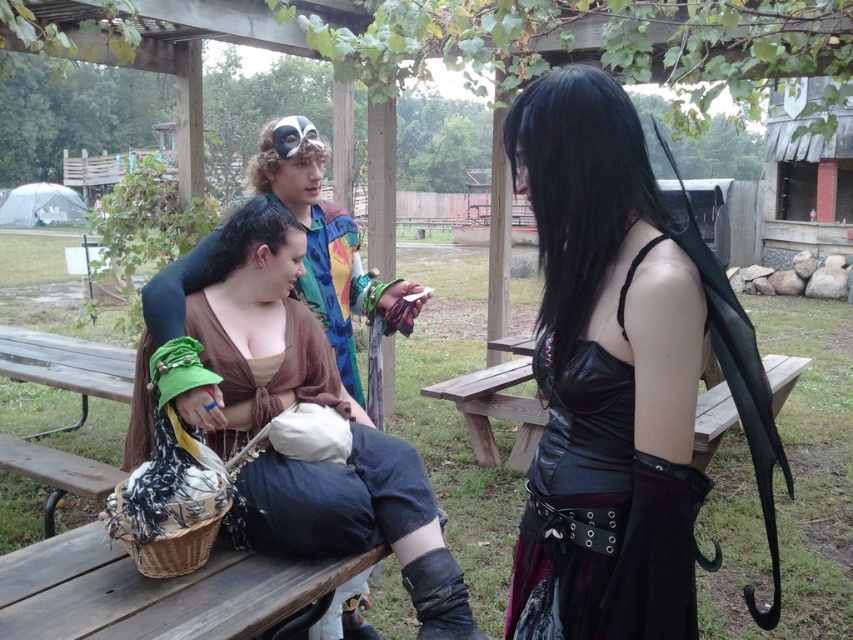
Question: Does brown fabric top at center have a greater width compared to green fabric purse at center?

Choices:
 (A) yes
 (B) no

Answer: (A)

Question: Among these objects, which one is farthest from the camera?

Choices:
 (A) woven wood picnic table at lower center
 (B) brown fabric top at center

Answer: (B)

Question: Where is brown fabric top at center located in relation to wooden bench at center in the image?

Choices:
 (A) below
 (B) above

Answer: (B)

Question: Among these objects, which one is farthest from the camera?

Choices:
 (A) brown fabric top at center
 (B) green fabric purse at center
 (C) black leather top at center

Answer: (A)

Question: Based on their relative distances, which object is nearer to the brown fabric top at center?

Choices:
 (A) wooden bench at center
 (B) green fabric purse at center
 (C) black leather top at center
 (D) woven wood picnic table at lower center

Answer: (B)

Question: Does woven wood picnic table at lower center have a smaller size compared to green fabric purse at center?

Choices:
 (A) yes
 (B) no

Answer: (A)